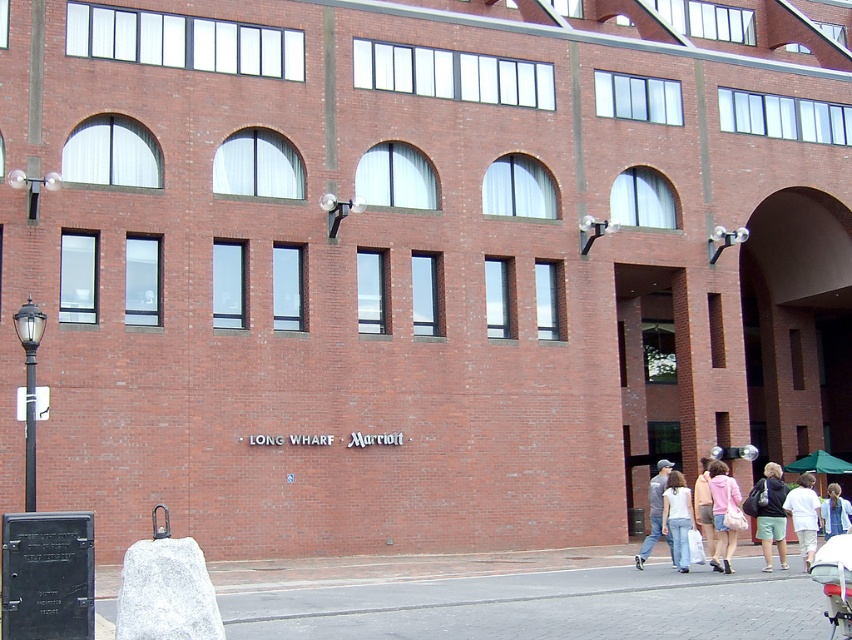
Can you confirm if brick pavement at lower center is smaller than black polished metal streetlamp at left?

Incorrect, brick pavement at lower center is not smaller in size than black polished metal streetlamp at left.

Where is `brick pavement at lower center`? The image size is (852, 640). brick pavement at lower center is located at coordinates (540, 605).

Find the location of `black metal plaque at lower left`. black metal plaque at lower left is located at coordinates (47, 576).

Is point (16, 513) farther from camera compared to point (694, 492)?

Yes.

The width and height of the screenshot is (852, 640). I want to click on black metal plaque at lower left, so click(x=47, y=576).

Does white cotton tank top at lower center appear on the left side of denim jacket at lower right?

Yes, white cotton tank top at lower center is to the left of denim jacket at lower right.

Between white cotton tank top at lower center and denim jacket at lower right, which one has less height?

With less height is denim jacket at lower right.

This screenshot has width=852, height=640. Identify the location of white cotton tank top at lower center. (677, 516).

At what (x,y) coordinates should I click in order to perform the action: click on white cotton tank top at lower center. Please return your answer as a coordinate pair (x, y). The width and height of the screenshot is (852, 640). Looking at the image, I should click on (677, 516).